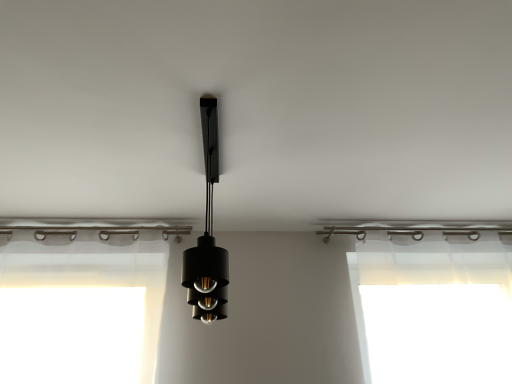
Question: Is transparent plastic at right inside the boundaries of black matte pendant light at center, or outside?

Choices:
 (A) outside
 (B) inside

Answer: (A)

Question: From the image's perspective, relative to black matte pendant light at center, is transparent plastic at right above or below?

Choices:
 (A) below
 (B) above

Answer: (A)

Question: Based on their positions, is transparent plastic at right located to the left or right of black matte pendant light at center?

Choices:
 (A) left
 (B) right

Answer: (B)

Question: From the image's perspective, is black matte pendant light at center above or below transparent plastic at right?

Choices:
 (A) below
 (B) above

Answer: (B)

Question: Looking at their shapes, would you say black matte pendant light at center is wider or thinner than transparent plastic at right?

Choices:
 (A) wide
 (B) thin

Answer: (A)

Question: Based on their sizes in the image, would you say black matte pendant light at center is bigger or smaller than transparent plastic at right?

Choices:
 (A) big
 (B) small

Answer: (B)

Question: Is point (210, 278) positioned closer to the camera than point (375, 329)?

Choices:
 (A) closer
 (B) farther

Answer: (A)